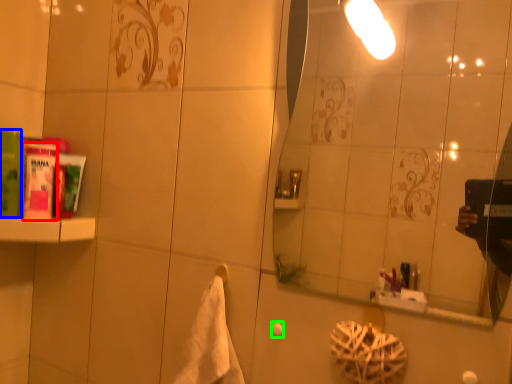
Question: Estimate the real-world distances between objects in this image. Which object is farther from mouthwash (highlighted by a red box), mouthwash (highlighted by a blue box) or towel bar (highlighted by a green box)?

Choices:
 (A) mouthwash
 (B) towel bar

Answer: (B)